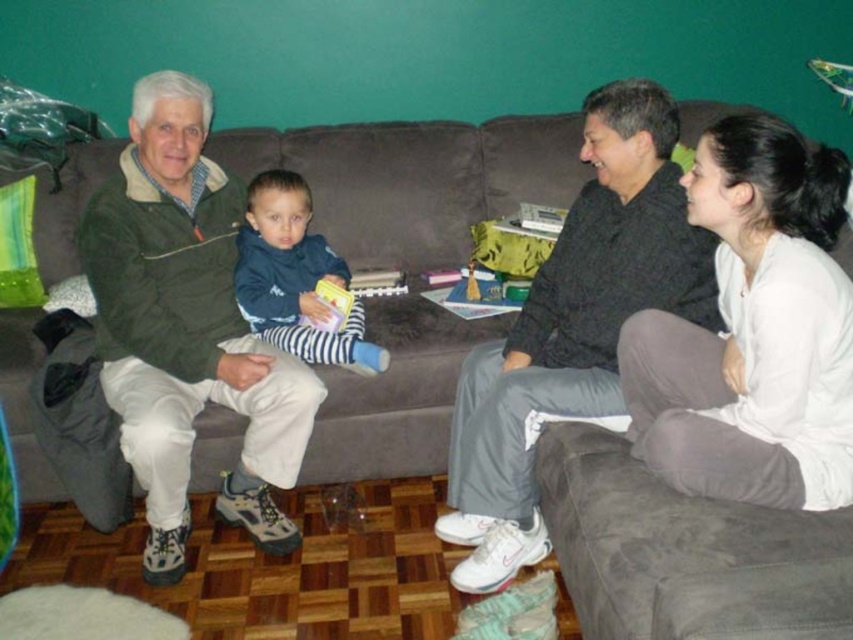
From the picture: You are a photographer taking a picture of the dark gray pants at right and the blue striped pants at center. Which one should you focus on first if you want to capture both in the same frame?

The dark gray pants at right is positioned on the right side of blue striped pants at center, so you should focus on the blue striped pants at center first to ensure both are in frame.

You are trying to decide which item is more suitable for a cold winter day. Based on the thickness, which item from the green textured jacket at left and the dark gray pants at right would be better?

The green textured jacket at left is thinner than the dark gray pants at right, so the dark gray pants at right would be better for a cold winter day due to their greater thickness.

Looking at the dark gray pants at right and the blue striped pants at center, which pair has a wider leg opening?

The dark gray pants at right has a wider leg opening since its width is larger than the blue striped pants at center.